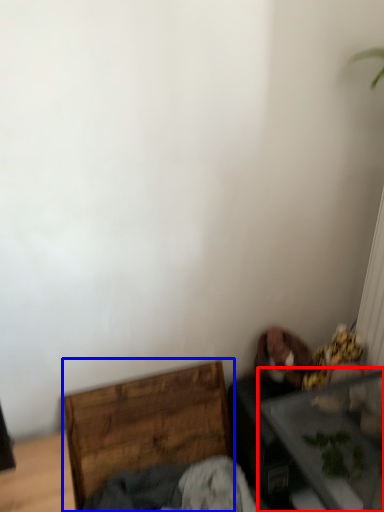
Question: Among these objects, which one is nearest to the camera, table (highlighted by a red box) or furniture (highlighted by a blue box)?

Choices:
 (A) table
 (B) furniture

Answer: (A)